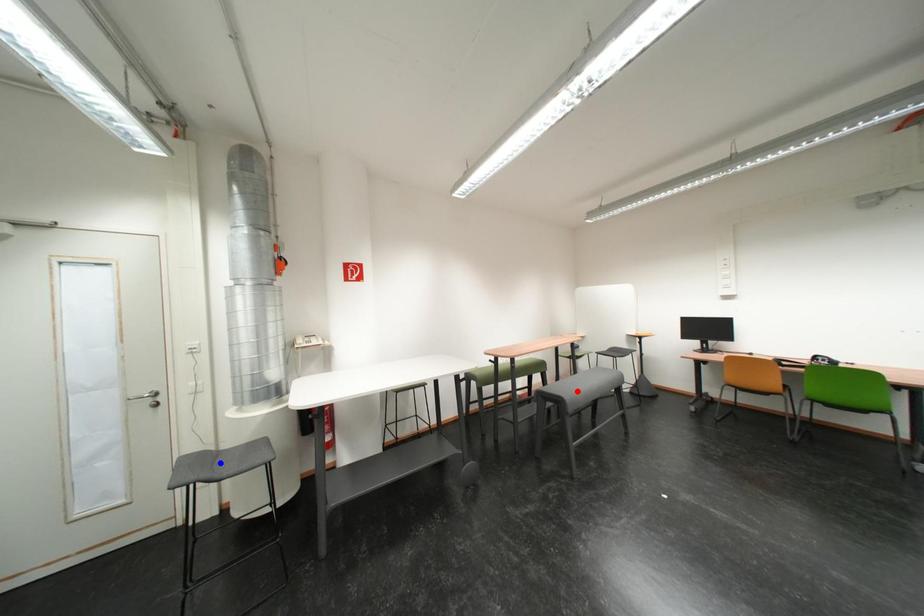
Question: Two points are marked on the image. Which point is closer to the camera?

Choices:
 (A) Blue point is closer.
 (B) Red point is closer.

Answer: (A)